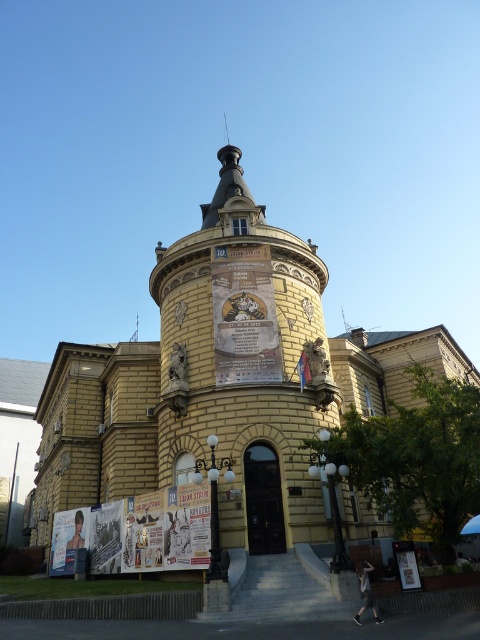
Does yellow stone building at center appear on the right side of white glossy posters at lower left?

No, yellow stone building at center is not to the right of white glossy posters at lower left.

Where is `yellow stone building at center`? Image resolution: width=480 pixels, height=640 pixels. yellow stone building at center is located at coordinates (219, 392).

The height and width of the screenshot is (640, 480). I want to click on yellow stone building at center, so click(x=219, y=392).

How distant is white glossy posters at lower left from yellow paper poster at center?

15.60 meters

Can you confirm if white glossy posters at lower left is positioned below yellow paper poster at center?

Yes.

Between point (208, 550) and point (261, 348), which one is positioned in front?

Point (208, 550) is in front.

I want to click on white glossy posters at lower left, so click(136, 532).

From the picture: Can you confirm if yellow stone building at center is wider than yellow paper poster at center?

Correct, the width of yellow stone building at center exceeds that of yellow paper poster at center.

Does yellow stone building at center appear over yellow paper poster at center?

Incorrect, yellow stone building at center is not positioned above yellow paper poster at center.

Is point (115, 481) more distant than point (243, 364)?

That is True.

The image size is (480, 640). In order to click on yellow stone building at center in this screenshot , I will do `click(219, 392)`.